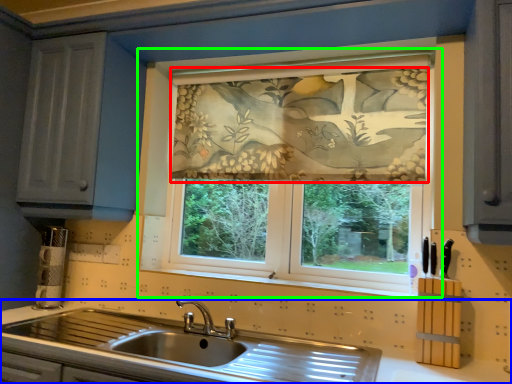
Question: Considering the real-world distances, which object is farthest from curtain (highlighted by a red box)? countertop (highlighted by a blue box) or window (highlighted by a green box)?

Choices:
 (A) countertop
 (B) window

Answer: (A)